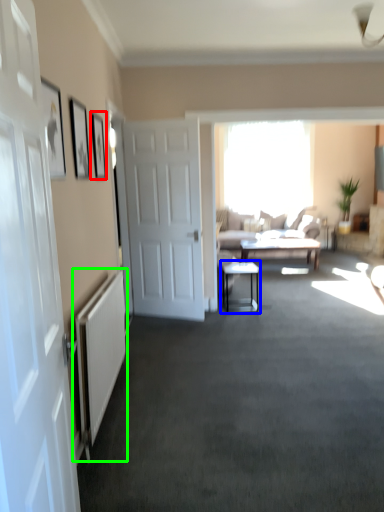
Question: Which is nearer to the picture frame (highlighted by a red box)? table (highlighted by a blue box) or radiator (highlighted by a green box).

Choices:
 (A) table
 (B) radiator

Answer: (B)